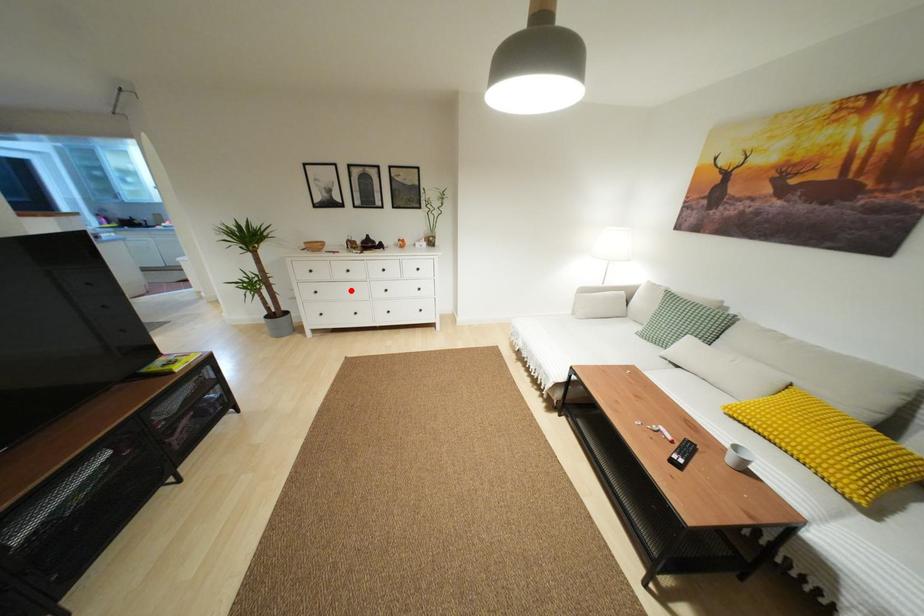
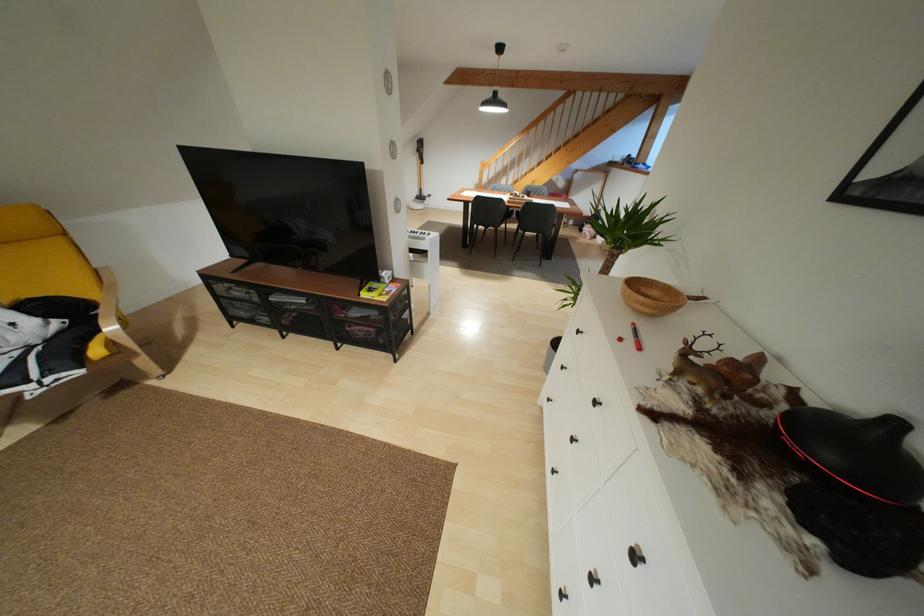
Question: I am providing you with two images of the same scene from different viewpoints. A red point is shown in image1. For the corresponding object point in image2, is it positioned nearer or farther from the camera?

Choices:
 (A) Nearer
 (B) Farther

Answer: (A)